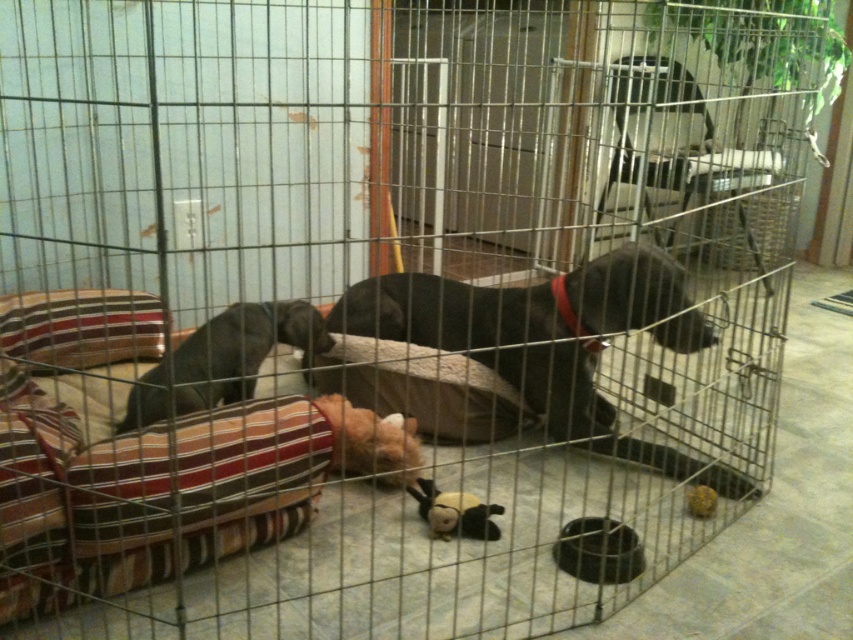
What do you see at coordinates (79, 328) in the screenshot?
I see `striped fabric pillow at left` at bounding box center [79, 328].

What do you see at coordinates (79, 328) in the screenshot? I see `striped fabric pillow at left` at bounding box center [79, 328].

Identify the location of striped fabric pillow at left. (79, 328).

Does dark gray fur at left lie behind fuzzy fabric stuffed animal at center?

That is False.

Does dark gray fur at left have a greater height compared to fuzzy fabric stuffed animal at center?

Indeed, dark gray fur at left has a greater height compared to fuzzy fabric stuffed animal at center.

The image size is (853, 640). Describe the element at coordinates (222, 358) in the screenshot. I see `dark gray fur at left` at that location.

Where is `dark gray fur at left`? The image size is (853, 640). dark gray fur at left is located at coordinates point(222,358).

This screenshot has height=640, width=853. What do you see at coordinates (143, 493) in the screenshot?
I see `striped fabric dog bed at lower left` at bounding box center [143, 493].

Is striped fabric dog bed at lower left in front of black plush toy at center?

That is True.

Is point (4, 600) more distant than point (483, 528)?

No.

The width and height of the screenshot is (853, 640). What are the coordinates of `striped fabric dog bed at lower left` in the screenshot? It's located at (143, 493).